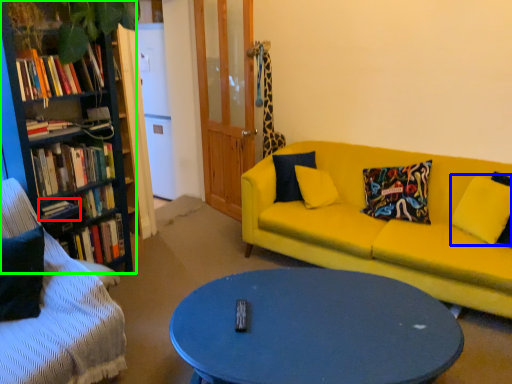
Question: Which object is the closest to the book (highlighted by a red box)? Choose among these: pillow (highlighted by a blue box) or bookcase (highlighted by a green box).

Choices:
 (A) pillow
 (B) bookcase

Answer: (B)